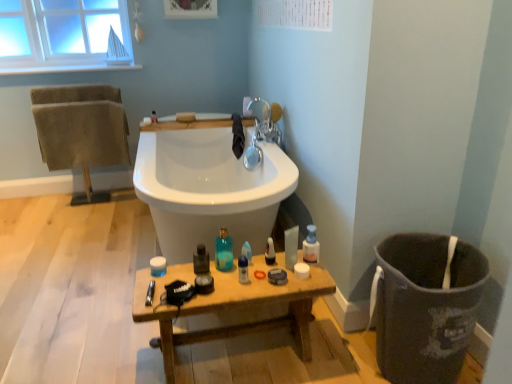
The image size is (512, 384). In order to click on free space to the left of translucent glass mouthwash at center, placed as the second mouthwash when sorted from right to left in this screenshot , I will do `click(170, 274)`.